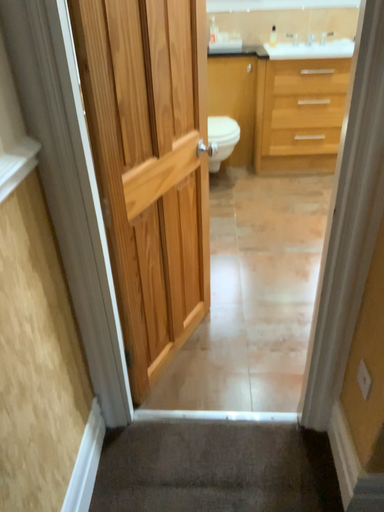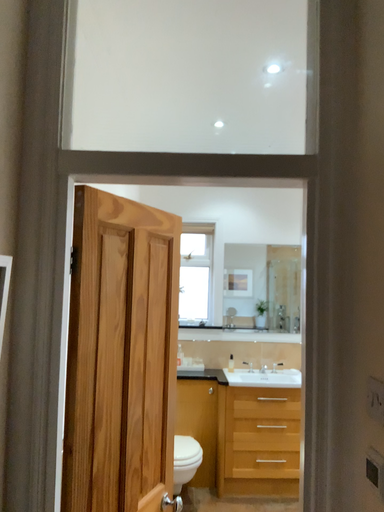
Question: How did the camera likely rotate when shooting the video?

Choices:
 (A) rotated downward
 (B) rotated upward

Answer: (B)